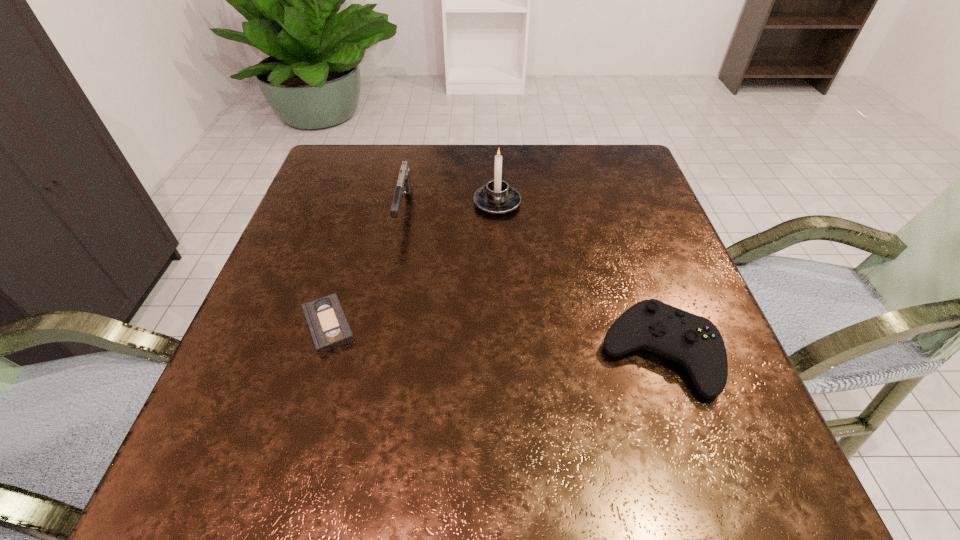
Identify which object is the second closest to the control. Please provide its 2D coordinates. Your answer should be formatted as a tuple, i.e. [(x, y)], where the tuple contains the x and y coordinates of a point satisfying the conditions above.

[(404, 184)]

You are a GUI agent. You are given a task and a screenshot of the screen. Output one action in this format:
    pyautogui.click(x=<x>, y=<y>)
    Task: Click on the vacant region that satisfies the following two spatial constraints: 1. at the muzzle end of the second tallest object; 2. on the left side of the third tallest object
    The image size is (960, 540).
    Given the screenshot: What is the action you would take?
    pyautogui.click(x=376, y=353)

This screenshot has height=540, width=960. In order to click on free location that satisfies the following two spatial constraints: 1. on the front side of the rightmost object; 2. on the left side of the leftmost object in this screenshot , I will do `click(320, 353)`.